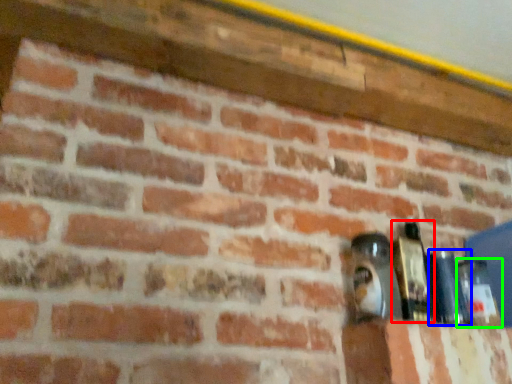
Question: Which is nearer to the bottle (highlighted by a red box)? bottle (highlighted by a blue box) or bottle (highlighted by a green box).

Choices:
 (A) bottle
 (B) bottle

Answer: (A)